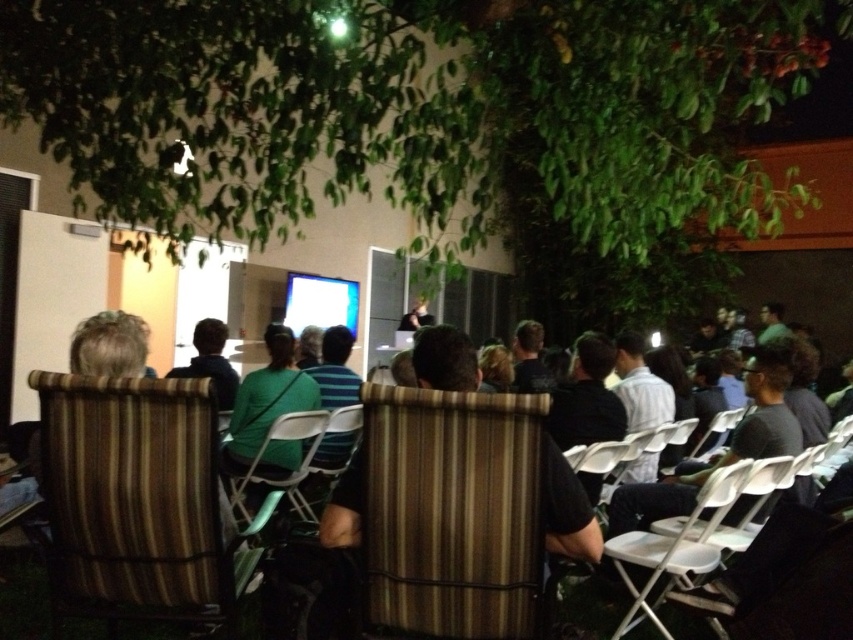
Can you confirm if green striped chair at center is bigger than white glossy projection screen at center?

Actually, green striped chair at center might be smaller than white glossy projection screen at center.

Is point (28, 557) positioned in front of point (328, 276)?

Yes, point (28, 557) is closer to viewer.

Is point (80, 632) behind point (339, 312)?

That is False.

Find the location of a particular element. The height and width of the screenshot is (640, 853). green striped chair at center is located at coordinates point(22,596).

Who is lower down, white glossy projection screen at center or striped fabric chair at center?

striped fabric chair at center

Where is `white glossy projection screen at center`? The image size is (853, 640). white glossy projection screen at center is located at coordinates (320, 301).

Can you confirm if green fabric chair at center is positioned above striped fabric chair at center?

No.

Is point (288, 420) positioned in front of point (308, 520)?

That is True.

Is point (248, 522) less distant than point (358, 417)?

Yes, point (248, 522) is closer to viewer.

The height and width of the screenshot is (640, 853). Find the location of `green fabric chair at center`. green fabric chair at center is located at coordinates (289, 470).